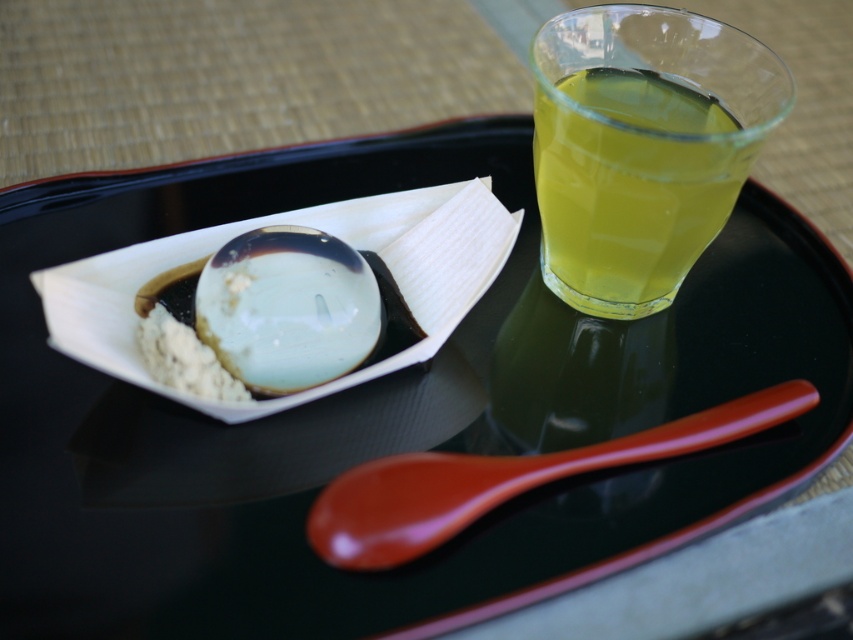
Question: Which is farther from the glossy plastic spoon at lower center?

Choices:
 (A) translucent glass cup at upper right
 (B) translucent glass ball at upper left

Answer: (A)

Question: Does translucent glass ball at upper left appear on the right side of glossy plastic spoon at lower center?

Choices:
 (A) no
 (B) yes

Answer: (A)

Question: Is translucent glass cup at upper right wider than glossy plastic spoon at lower center?

Choices:
 (A) yes
 (B) no

Answer: (B)

Question: Among these points, which one is farthest from the camera?

Choices:
 (A) (268, 333)
 (B) (402, 500)
 (C) (554, 88)

Answer: (C)

Question: Is translucent glass cup at upper right in front of translucent glass ball at upper left?

Choices:
 (A) yes
 (B) no

Answer: (B)

Question: Which point is closer to the camera?

Choices:
 (A) (347, 349)
 (B) (462, 493)

Answer: (B)